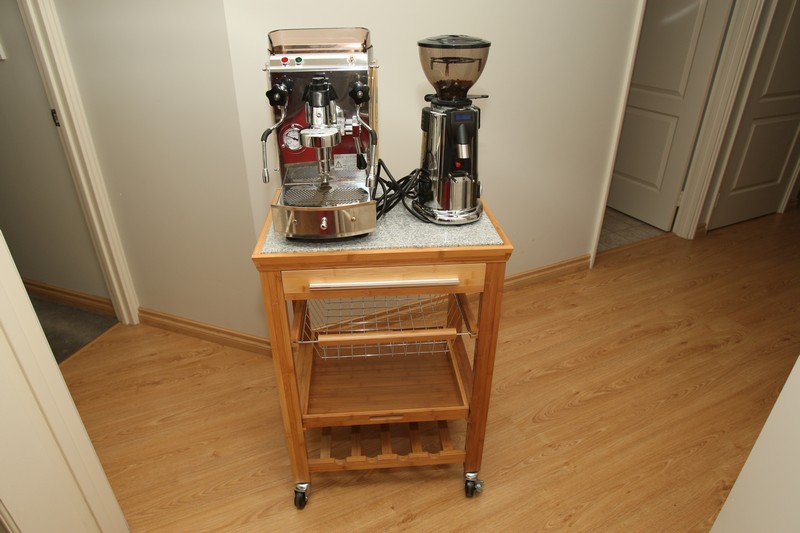
In order to click on expresso machine in this screenshot , I will do `click(318, 190)`.